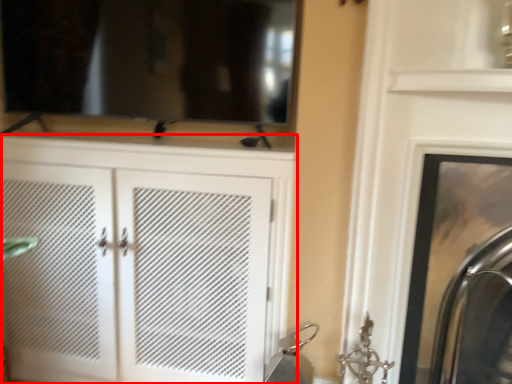
Question: From the image's perspective, considering the relative positions of cupboard (annotated by the red box) and fireplace in the image provided, where is cupboard (annotated by the red box) located with respect to the staircase?

Choices:
 (A) below
 (B) above

Answer: (B)